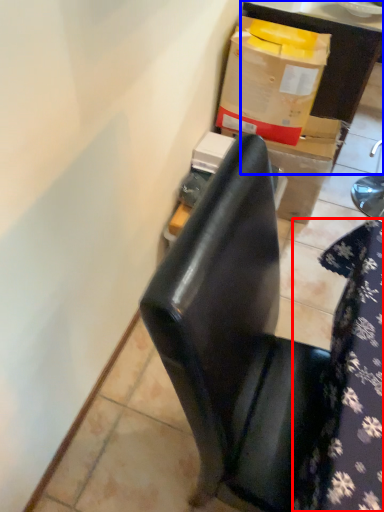
Question: Which object appears closest to the camera in this image, tablecloth (highlighted by a red box) or furniture (highlighted by a blue box)?

Choices:
 (A) tablecloth
 (B) furniture

Answer: (A)